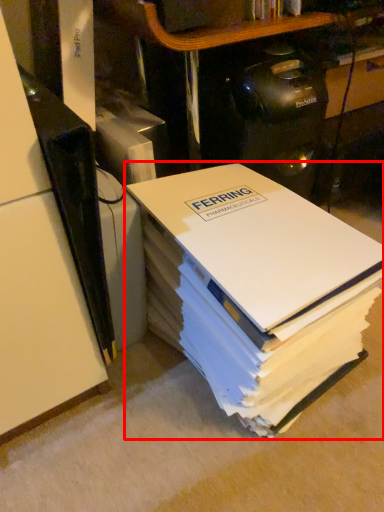
Question: From the image's perspective, considering the relative positions of book (annotated by the red box) and shelf in the image provided, where is book (annotated by the red box) located with respect to the staircase?

Choices:
 (A) below
 (B) above

Answer: (A)